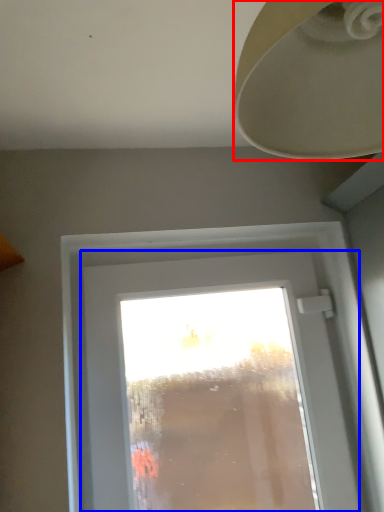
Question: Which object is further to the camera taking this photo, lamp (highlighted by a red box) or window (highlighted by a blue box)?

Choices:
 (A) lamp
 (B) window

Answer: (B)